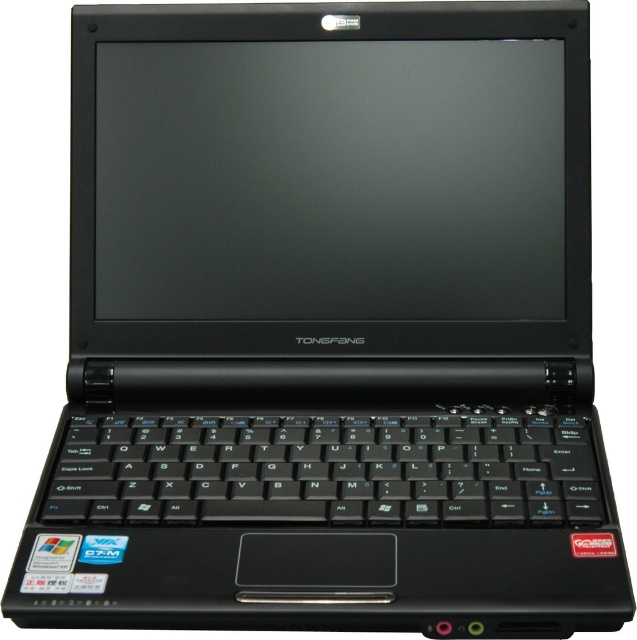
Does black matte screen at center lie behind black plastic keyboard at center?

Yes, black matte screen at center is behind black plastic keyboard at center.

Who is more forward, (520,218) or (150,472)?

Point (150,472) is more forward.

Locate an element on the screen. This screenshot has width=637, height=640. black matte screen at center is located at coordinates (329, 180).